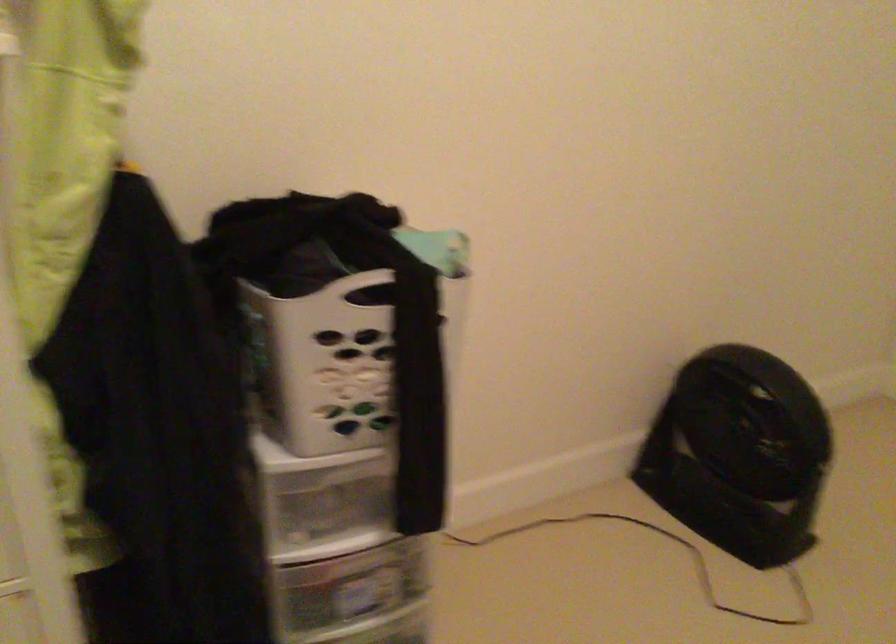
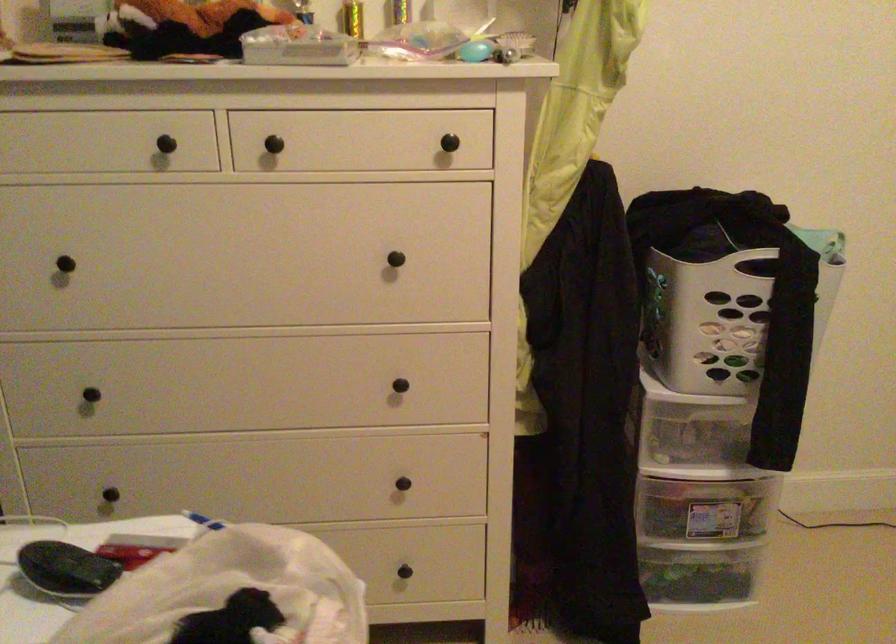
Locate, in the second image, the point that corresponds to the point at 329,502 in the first image.

(695, 438)